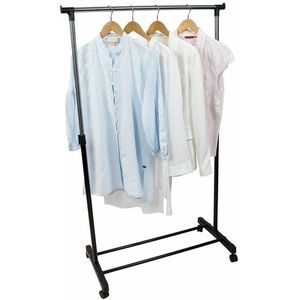
At what (x,y) coordinates should I click in order to perform the action: click on hook. Please return your answer as a coordinate pair (x, y). Looking at the image, I should click on (111, 8), (132, 8), (159, 8), (190, 7).